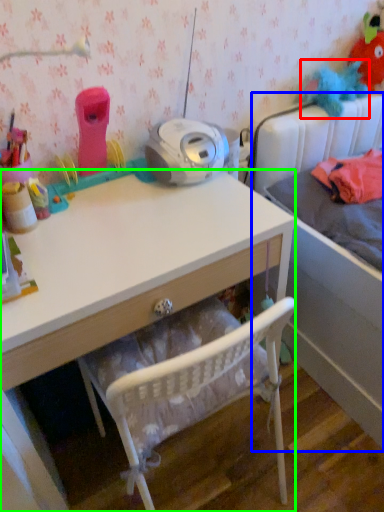
Question: Considering the real-world distances, which object is closest to toy (highlighted by a red box)? bed (highlighted by a blue box) or desk (highlighted by a green box).

Choices:
 (A) bed
 (B) desk

Answer: (A)